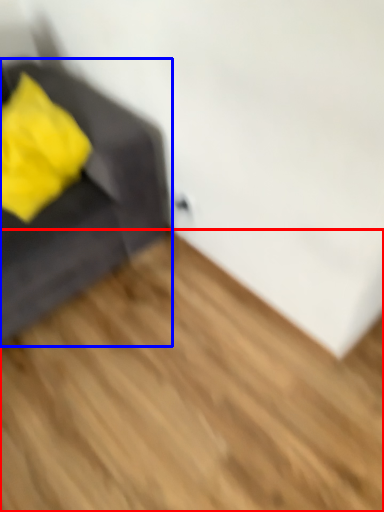
Question: Which object appears farthest to the camera in this image, hardwood (highlighted by a red box) or furniture (highlighted by a blue box)?

Choices:
 (A) hardwood
 (B) furniture

Answer: (B)